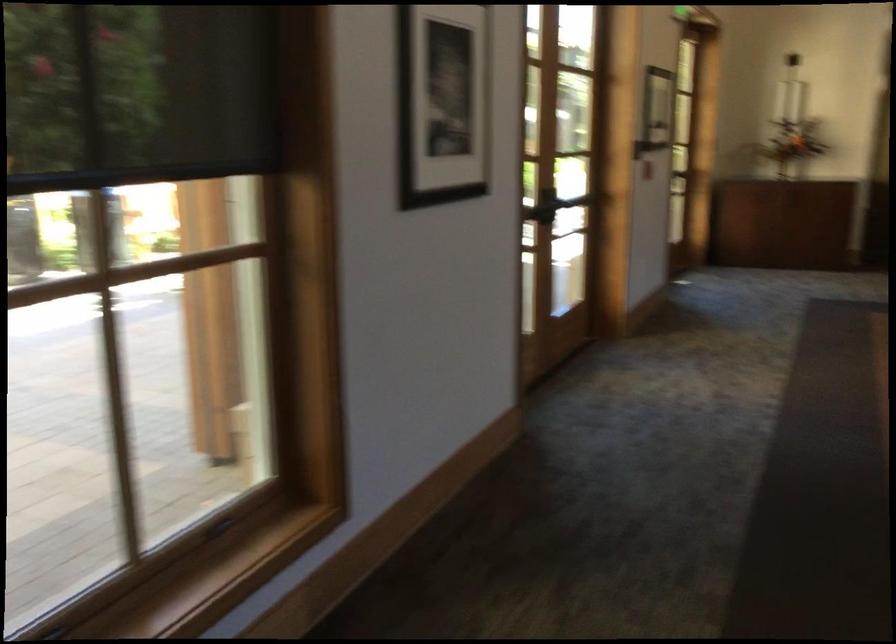
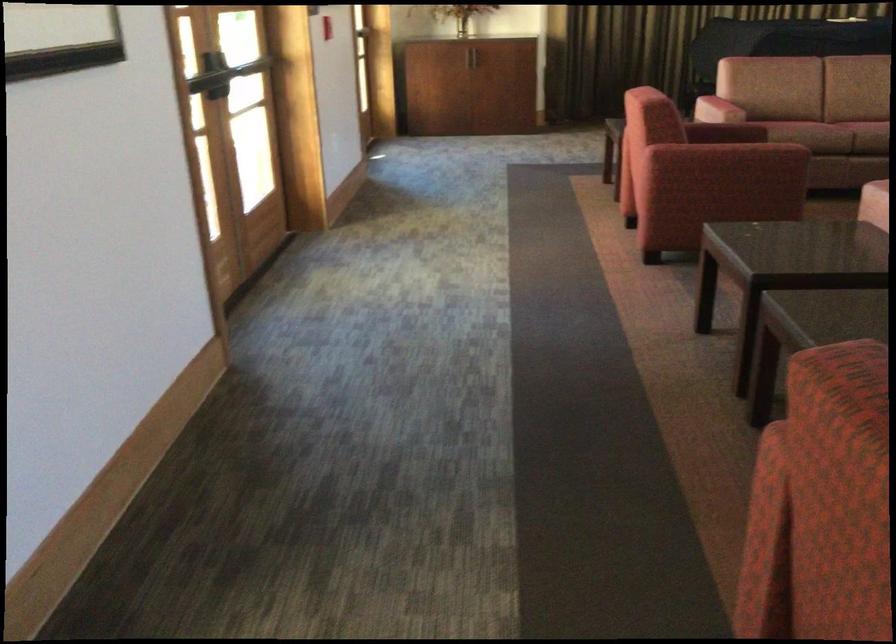
Question: What movement of the cameraman would produce the second image?

Choices:
 (A) Left
 (B) Right
 (C) Forward
 (D) Backward

Answer: (C)